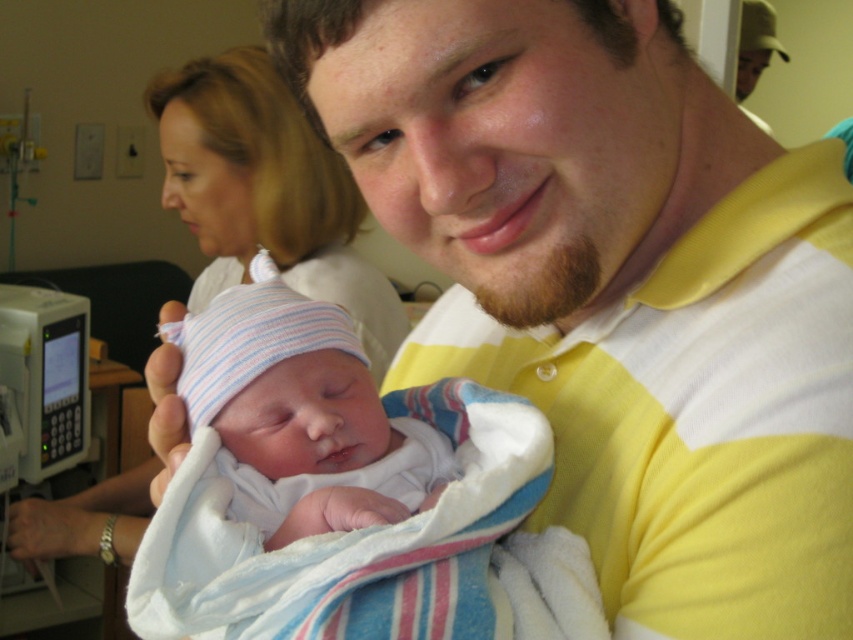
Question: Which object is positioned farthest from the yellow striped polo shirt at center?

Choices:
 (A) striped knit hat at center
 (B) smooth white shirt at upper left

Answer: (B)

Question: Does yellow striped polo shirt at center appear over striped knit hat at center?

Choices:
 (A) yes
 (B) no

Answer: (A)

Question: In this image, where is yellow striped polo shirt at center located relative to striped knit hat at center?

Choices:
 (A) above
 (B) below

Answer: (A)

Question: Among these points, which one is nearest to the camera?

Choices:
 (A) (399, 24)
 (B) (183, 202)
 (C) (398, 518)

Answer: (A)

Question: In this image, where is yellow striped polo shirt at center located relative to striped knit hat at center?

Choices:
 (A) left
 (B) right

Answer: (B)

Question: Considering the real-world distances, which object is closest to the striped knit hat at center?

Choices:
 (A) smooth white shirt at upper left
 (B) yellow striped polo shirt at center

Answer: (B)